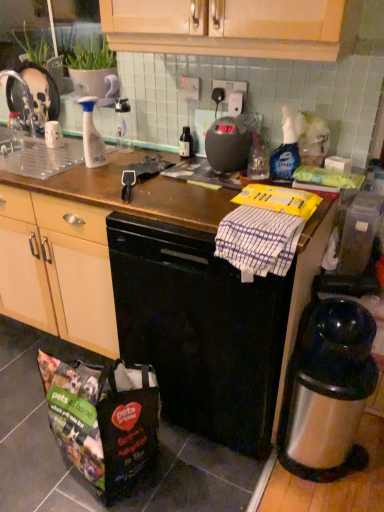
Question: In the image, is clear plastic bottle at center, the 3th bottle viewed from the right, positioned in front of or behind brown wooden counter top at center?

Choices:
 (A) behind
 (B) front

Answer: (A)

Question: In terms of size, does clear plastic bottle at center, the 2th bottle in the left-to-right sequence, appear bigger or smaller than brown wooden counter top at center?

Choices:
 (A) big
 (B) small

Answer: (B)

Question: Considering the real-world distances, which object is closest to the black matte dishwasher at center?

Choices:
 (A) glossy plastic spray bottle at upper right, acting as the 4th bottle starting from the left
 (B) white striped towel at center
 (C) brown wooden counter top at center
 (D) translucent plastic spray bottle at center-left, which is counted as the 4th bottle, starting from the right
 (E) polyester shopping bag at lower left

Answer: (C)

Question: Which of these objects is positioned closest to the transparent plastic container at right?

Choices:
 (A) brown wooden counter top at center
 (B) black matte dishwasher at center
 (C) black plastic scale at center
 (D) polyester shopping bag at lower left
 (E) glossy plastic spray bottle at upper right, the 1th bottle in the right-to-left sequence

Answer: (E)